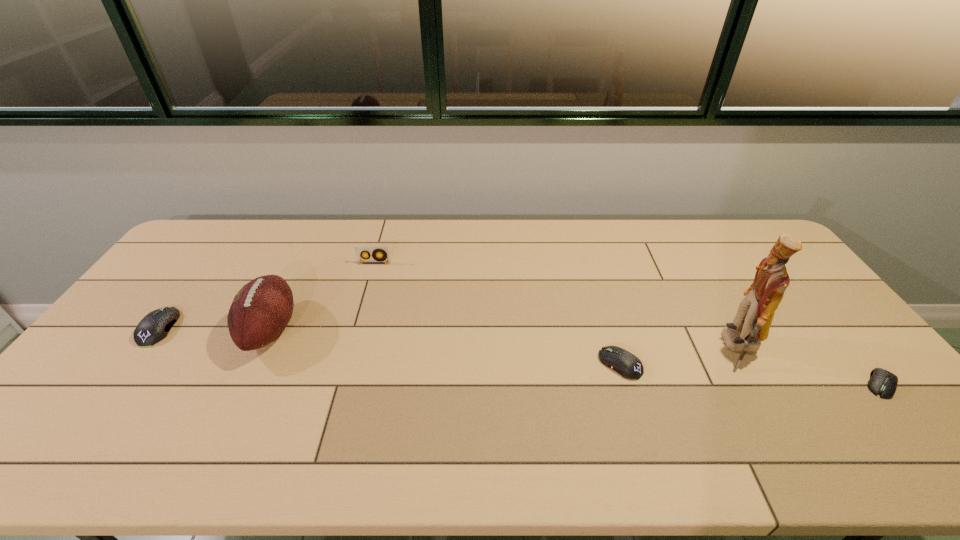
If equal spacing is desired by inserting an extra mouse_(computer_equipment) among them, please point out a free spot for this new mouse_(computer_equipment). Please provide its 2D coordinates. Your answer should be formatted as a tuple, i.e. [(x, y)], where the tuple contains the x and y coordinates of a point satisfying the conditions above.

[(380, 345)]